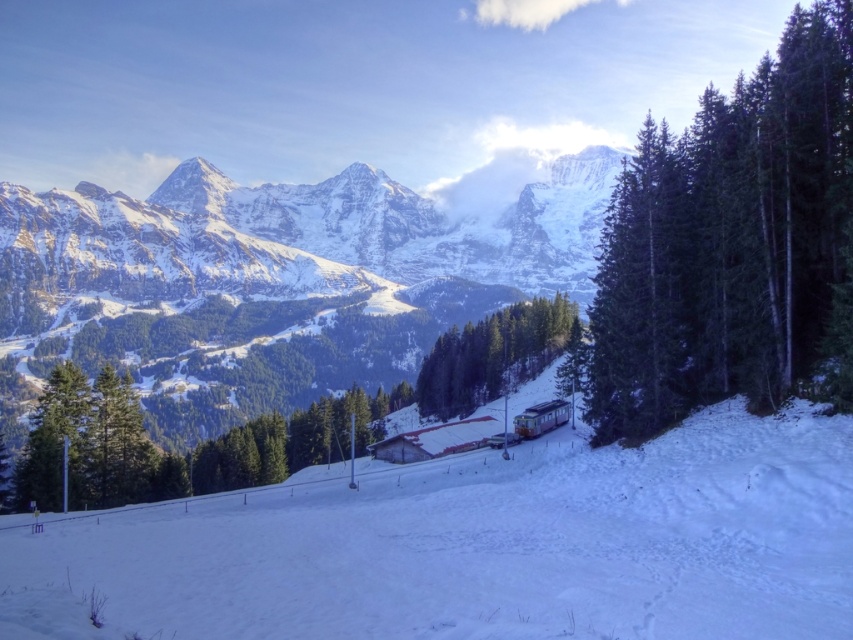
You are a skier standing at the top of the white snow ski slope at center. You want to ski down to the bottom of the slope. Which direction should you go to reach the bottom?

The white snow ski slope at center is located at point (480, 545), so you should go downward to reach the bottom of the slope.

You are standing at the base of the snowy granite mountain range at upper center. You want to reach the summit. Given that the average human walking speed is 5 km per hour and the mountain has a slope of 15 degrees, how many hours will it take you to climb to the top?

The snowy granite mountain range at upper center is 268.93 meters away from viewer. Using trigonometry, the vertical height is 268.93 meters multiplied by sine of 15 degrees, which is approximately 268.93 m x 0.2588 equals 69.69 meters. Converting this to kilometers gives 0.06969 km. At 5 km per hour, the time required would be 0.06969 km divided by 5 km per hour equals approximately 0.0139 hours, which is roughly 0.83 minutes or about 50 seconds. However, this calculation assumes ideal conditions without

You are a winter sports enthusiast planning to ski down the white snow ski slope at center. The snowy granite mountain range at upper center has a base that is 1000 feet wide. If you start from the top of the slope, will you be able to jump over the mountain range?

The distance between the white snow ski slope at center and the snowy granite mountain range at upper center is 753.84 feet. Since the mountain base is 1000 feet wide, the jump distance required would need to cover more than 753.84 feet. However, typical ski jumps rarely exceed 500 feet, so it is unlikely you can jump over the mountain range.